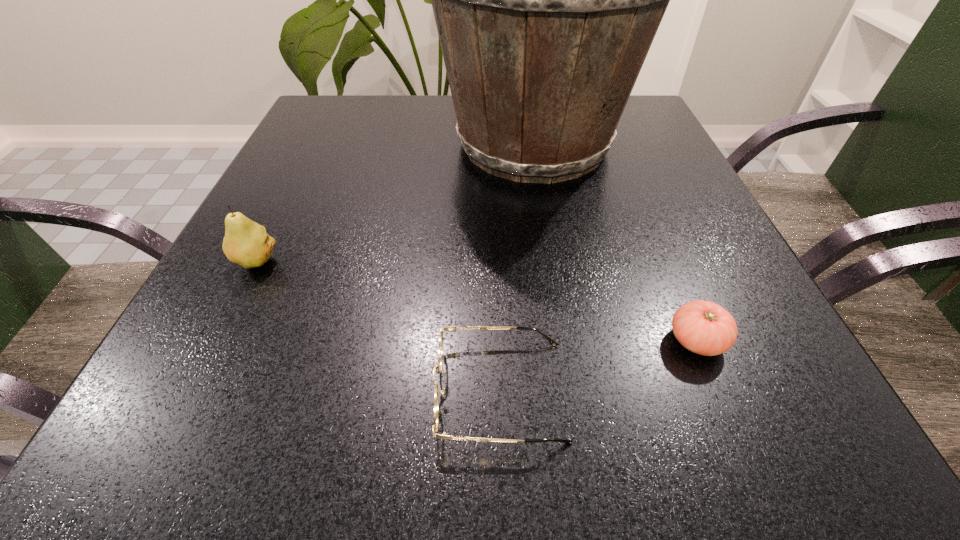
The image size is (960, 540). Identify the location of the tallest object. (546, 0).

I want to click on the farthest object, so click(546, 0).

Image resolution: width=960 pixels, height=540 pixels. I want to click on the leftmost object, so [246, 243].

This screenshot has width=960, height=540. What are the coordinates of `pear` in the screenshot? It's located at (246, 243).

You are a GUI agent. You are given a task and a screenshot of the screen. Output one action in this format:
    pyautogui.click(x=<x>, y=<y>)
    Task: Click on the tomato
    
    Given the screenshot: What is the action you would take?
    pyautogui.click(x=703, y=327)

You are a GUI agent. You are given a task and a screenshot of the screen. Output one action in this format:
    pyautogui.click(x=<x>, y=<y>)
    Task: Click on the spectacles
    This screenshot has width=960, height=540.
    Given the screenshot: What is the action you would take?
    (x=438, y=367)

I want to click on free spot located 0.070m on the right of the bucket, so click(x=666, y=144).

Where is `vacant space located on the right of the pear`? The height and width of the screenshot is (540, 960). vacant space located on the right of the pear is located at coordinates [340, 262].

Locate an element on the screen. The width and height of the screenshot is (960, 540). vacant space located 0.200m on the left of the tomato is located at coordinates (523, 340).

At what (x,y) coordinates should I click in order to perform the action: click on free space located on the lenses of the spectacles. Please return your answer as a coordinate pair (x, y). Looking at the image, I should click on (158, 390).